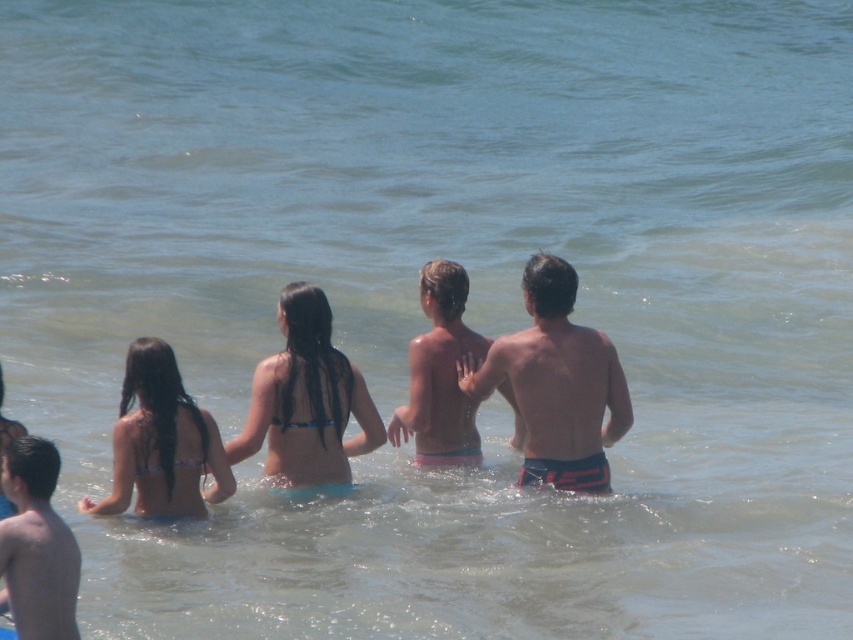
Question: Estimate the real-world distances between objects in this image. Which object is closer to the smooth skin boy at lower left?

Choices:
 (A) dark red swim trunks at center
 (B) matte blue bikini at center
 (C) pink fabric shorts at center
 (D) blue bikini top at center

Answer: (B)

Question: Can you confirm if matte blue bikini at center is positioned to the left of smooth skin boy at lower left?

Choices:
 (A) no
 (B) yes

Answer: (A)

Question: Which point is closer to the camera?

Choices:
 (A) (538, 388)
 (B) (41, 472)

Answer: (B)

Question: Is blue bikini top at center to the right of matte blue bikini at center from the viewer's perspective?

Choices:
 (A) yes
 (B) no

Answer: (A)

Question: Is matte blue bikini at center above pink fabric shorts at center?

Choices:
 (A) no
 (B) yes

Answer: (A)

Question: Based on their relative distances, which object is nearer to the blue bikini top at center?

Choices:
 (A) smooth skin boy at lower left
 (B) pink fabric shorts at center
 (C) matte blue bikini at center

Answer: (C)